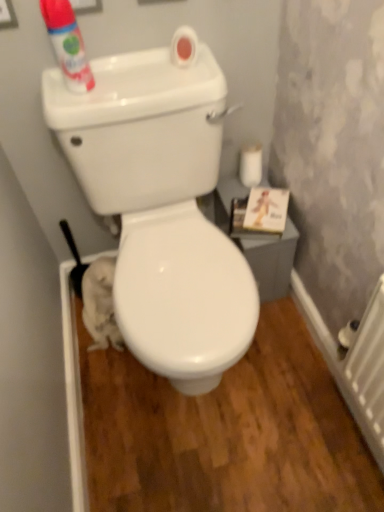
Find the location of a particular element. Image resolution: width=384 pixels, height=512 pixels. free space in front of matte white can at upper left is located at coordinates (88, 110).